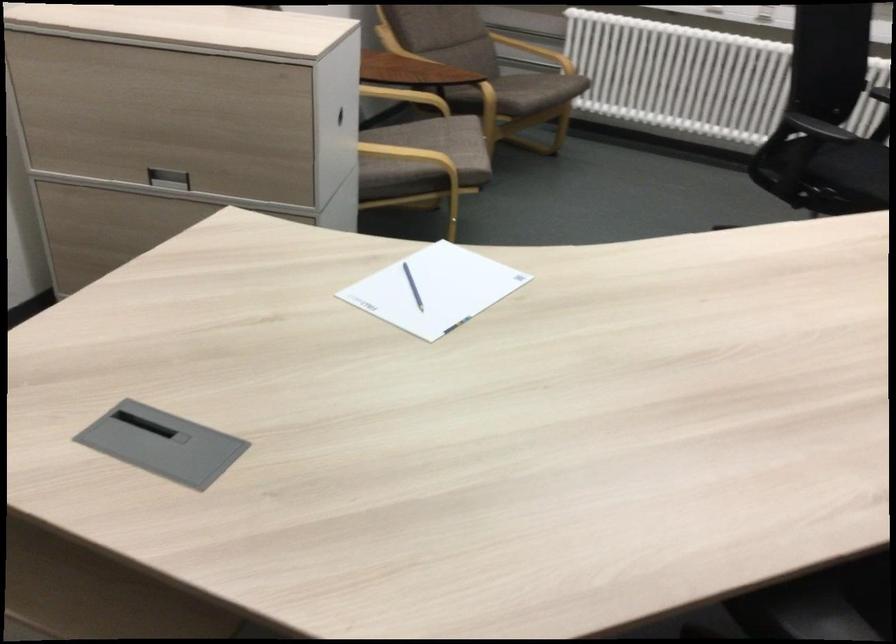
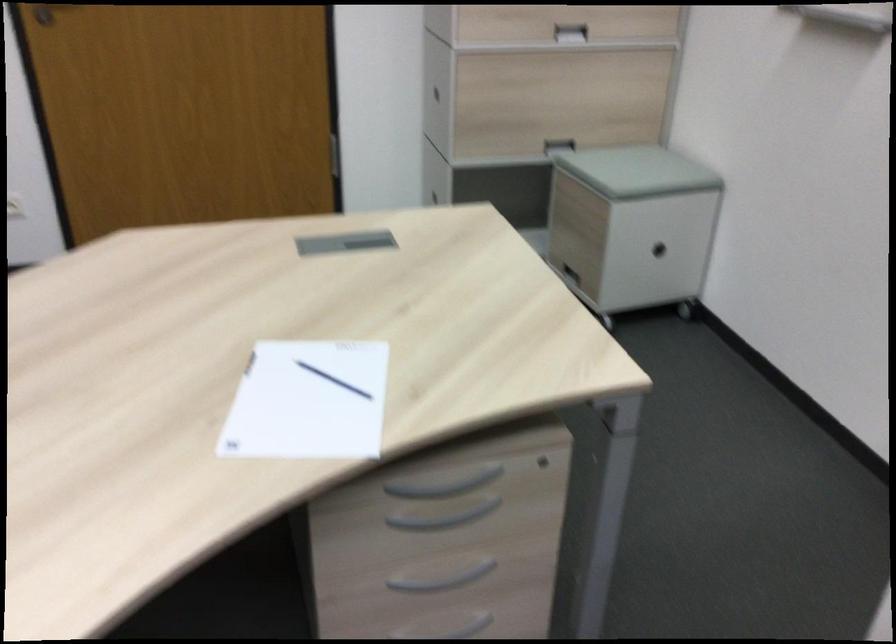
Find the pixel in the second image that matches pixel 394 299 in the first image.

(333, 380)